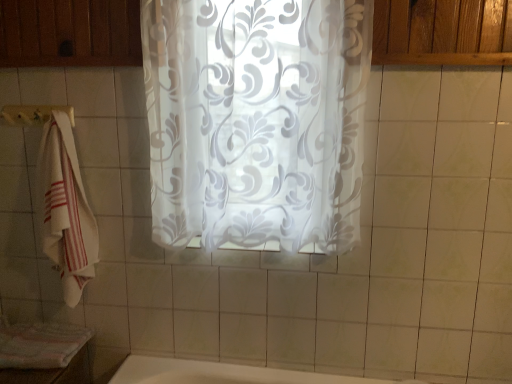
Question: Is white fabric towel bar at left behind striped cotton bath towel at lower left?

Choices:
 (A) yes
 (B) no

Answer: (A)

Question: Considering the relative sizes of white fabric towel bar at left and striped cotton bath towel at lower left in the image provided, is white fabric towel bar at left bigger than striped cotton bath towel at lower left?

Choices:
 (A) no
 (B) yes

Answer: (A)

Question: Considering the relative sizes of white fabric towel bar at left and striped cotton bath towel at lower left in the image provided, is white fabric towel bar at left thinner than striped cotton bath towel at lower left?

Choices:
 (A) no
 (B) yes

Answer: (B)

Question: Are white fabric towel bar at left and striped cotton bath towel at lower left located far from each other?

Choices:
 (A) no
 (B) yes

Answer: (A)

Question: From the image's perspective, is white fabric towel bar at left located beneath striped cotton bath towel at lower left?

Choices:
 (A) no
 (B) yes

Answer: (A)

Question: Is white fabric towel bar at left to the right of striped cotton bath towel at lower left from the viewer's perspective?

Choices:
 (A) yes
 (B) no

Answer: (A)

Question: Would you say white fabric towel bar at left is outside white cotton towel at left?

Choices:
 (A) yes
 (B) no

Answer: (B)

Question: From a real-world perspective, does white fabric towel bar at left sit lower than white cotton towel at left?

Choices:
 (A) yes
 (B) no

Answer: (B)

Question: Does white fabric towel bar at left appear on the right side of white cotton towel at left?

Choices:
 (A) yes
 (B) no

Answer: (B)

Question: Considering the relative sizes of white fabric towel bar at left and white cotton towel at left in the image provided, is white fabric towel bar at left taller than white cotton towel at left?

Choices:
 (A) yes
 (B) no

Answer: (B)

Question: Would you say white fabric towel bar at left contains white cotton towel at left?

Choices:
 (A) yes
 (B) no

Answer: (B)

Question: Is white fabric towel bar at left turned away from white cotton towel at left?

Choices:
 (A) no
 (B) yes

Answer: (B)

Question: Is striped cotton bath towel at lower left bigger than white cotton towel at left?

Choices:
 (A) yes
 (B) no

Answer: (B)